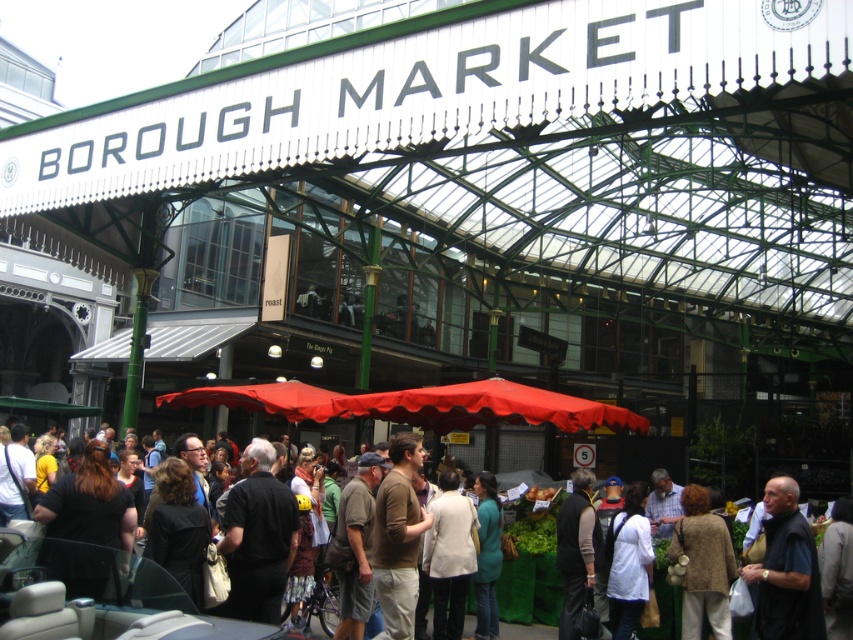
You are a customer at Borough Market and want to see the items under the red canopy tent. There are two people in your way, wearing a black matte shirt at center and a dark gray fabric jacket at lower right. Which person is closer to you?

The dark gray fabric jacket at lower right is behind the black matte shirt at center, so the black matte shirt at center is closer to you.

You are a delivery person carrying a heavy box and need to navigate through Borough Market. You see the black matte shirt at center and the dark gray fabric jacket at lower right. Can you safely pass between them without bumping into anyone?

The distance between the black matte shirt at center and the dark gray fabric jacket at lower right is 61.81 feet, which is more than enough space for a delivery person to safely pass through without bumping into anyone.